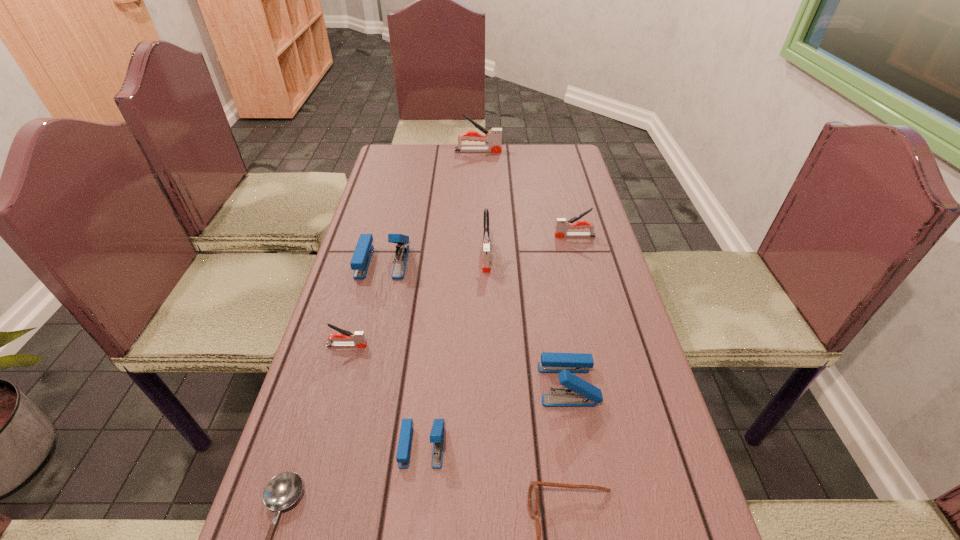
Where is `vacant space located on the handle side of the smallest gray stapler`? This screenshot has height=540, width=960. vacant space located on the handle side of the smallest gray stapler is located at coordinates (388, 346).

Identify the location of vacant region located 0.250m on the right of the nearest stapler. (575, 446).

Identify the location of object at the far edge. The image size is (960, 540). (494, 136).

Where is `free region at the left edge of the desktop`? free region at the left edge of the desktop is located at coordinates 308,432.

The width and height of the screenshot is (960, 540). In the image, there is a desktop. Find the location of `vacant space at the right edge`. vacant space at the right edge is located at coordinates (552, 193).

In the image, there is a desktop. Where is `blank space at the far left corner`? The width and height of the screenshot is (960, 540). blank space at the far left corner is located at coordinates (400, 170).

Image resolution: width=960 pixels, height=540 pixels. What are the coordinates of `vacant space at the far right corner` in the screenshot? It's located at (543, 157).

You are a GUI agent. You are given a task and a screenshot of the screen. Output one action in this format:
    pyautogui.click(x=<x>, y=<y>)
    Task: Click on the free space between the third biggest gray stapler and the third farthest gray stapler
    This screenshot has width=960, height=540.
    Given the screenshot: What is the action you would take?
    pyautogui.click(x=531, y=246)

This screenshot has height=540, width=960. In order to click on vacant space that is in between the leftmost blue stapler and the nearest stapler in this screenshot , I will do `click(402, 354)`.

The width and height of the screenshot is (960, 540). Find the location of `free space between the third nearest object and the third farthest gray stapler`. free space between the third nearest object and the third farthest gray stapler is located at coordinates (454, 350).